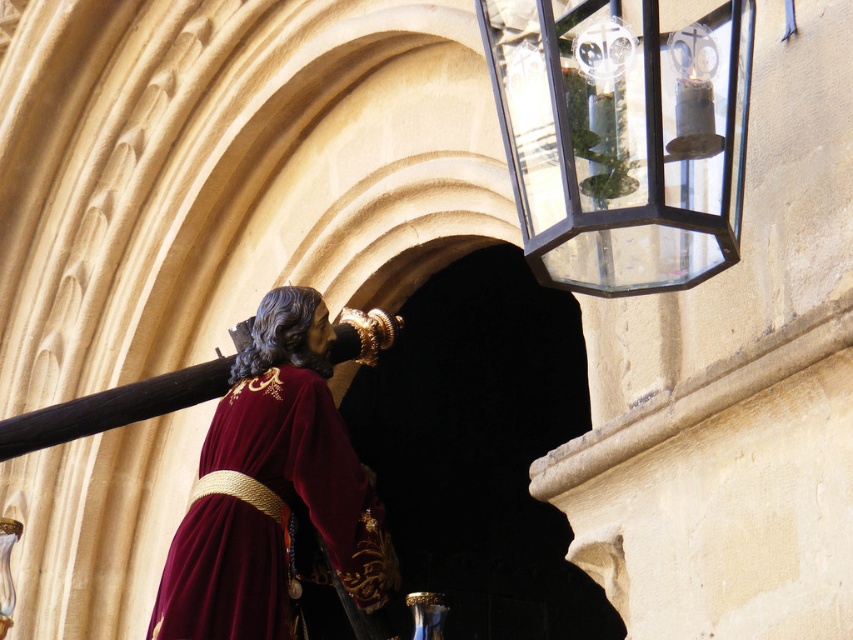
You are an artist who wants to paint the statue and the lantern in the scene. You have a canvas that is 1 meter tall. If you want to include both the clear glass lantern at upper right and the velvet maroon robe at center, will the canvas be tall enough?

The clear glass lantern at upper right is not as tall as velvet maroon robe at center. Since the robe is taller, and the canvas is 1 meter tall, it depends on the actual height of the robe. However, the question does not provide the exact height of the robe, so we cannot definitively determine if the canvas is tall enough.

You are an artist planning to sketch this scene. You need to ensure the clear glass lantern at upper right and the velvet maroon robe at center are positioned correctly. Based on the scene description, which object should be drawn higher on your paper?

The clear glass lantern at upper right should be drawn higher on the paper because it is positioned above the velvet maroon robe at center according to the description.

Based on the coordinates provided, where is the clear glass lantern at upper right located in the image?

The clear glass lantern at upper right is located at coordinates point (x=622, y=138) in the image.